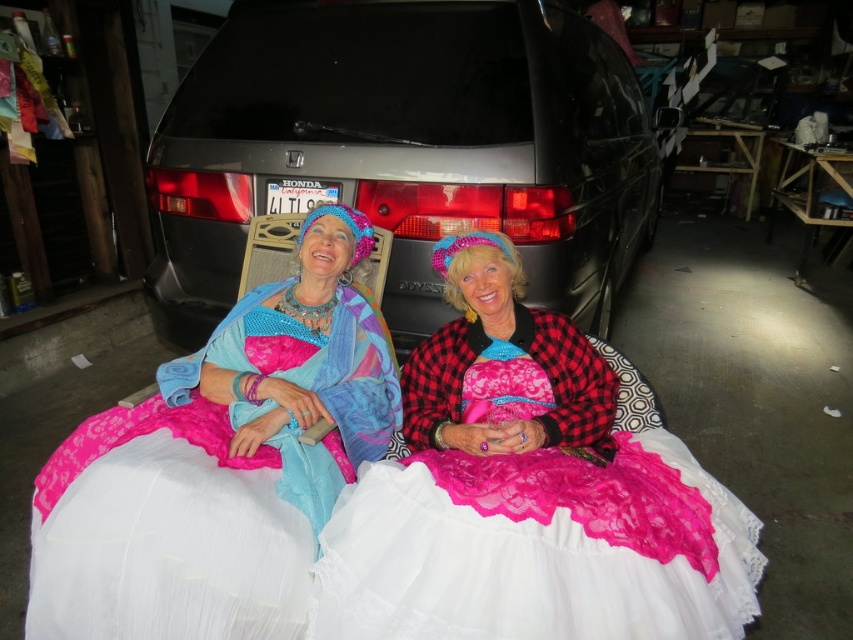
Question: Does pink lace dress at center lie in front of lace fabric dress at center?

Choices:
 (A) yes
 (B) no

Answer: (A)

Question: Does black plastic van at center come in front of lace fabric dress at center?

Choices:
 (A) yes
 (B) no

Answer: (B)

Question: Which object is closer to the camera taking this photo?

Choices:
 (A) lace fabric dress at center
 (B) pink lace dress at center
 (C) black plastic van at center

Answer: (B)

Question: Which of the following is the closest to the observer?

Choices:
 (A) (306, 520)
 (B) (641, 451)

Answer: (A)

Question: Which of the following is the closest to the observer?

Choices:
 (A) lace fabric dress at center
 (B) pink lace dress at center

Answer: (B)

Question: Where is pink lace dress at center located in relation to lace fabric dress at center in the image?

Choices:
 (A) left
 (B) right

Answer: (B)